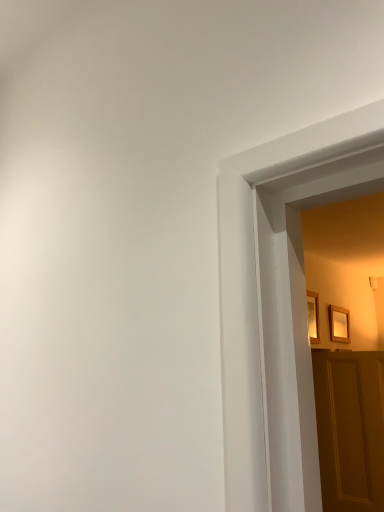
Question: Can you confirm if wooden picture frame at upper right, the first picture frame from the front, is taller than wooden panelled door at right?

Choices:
 (A) no
 (B) yes

Answer: (A)

Question: Is wooden picture frame at upper right, acting as the 1th picture frame starting from the left, surrounding wooden panelled door at right?

Choices:
 (A) no
 (B) yes

Answer: (A)

Question: Is wooden picture frame at upper right, the 2th picture frame in the back-to-front sequence, at the left side of wooden panelled door at right?

Choices:
 (A) yes
 (B) no

Answer: (A)

Question: From the image's perspective, is wooden picture frame at upper right, the 2th picture frame in the back-to-front sequence, located above wooden panelled door at right?

Choices:
 (A) no
 (B) yes

Answer: (B)

Question: Considering the relative sizes of wooden picture frame at upper right, the 2th picture frame in the back-to-front sequence, and wooden panelled door at right in the image provided, is wooden picture frame at upper right, the 2th picture frame in the back-to-front sequence, thinner than wooden panelled door at right?

Choices:
 (A) no
 (B) yes

Answer: (B)

Question: Considering the relative sizes of wooden picture frame at upper right, the 2th picture frame in the back-to-front sequence, and wooden panelled door at right in the image provided, is wooden picture frame at upper right, the 2th picture frame in the back-to-front sequence, bigger than wooden panelled door at right?

Choices:
 (A) yes
 (B) no

Answer: (B)

Question: Is wooden picture frame at upper right, marked as the first picture frame in a back-to-front arrangement, not inside wooden panelled door at right?

Choices:
 (A) no
 (B) yes

Answer: (B)

Question: Is wooden picture frame at upper right, the 1th picture frame in the right-to-left sequence, thinner than wooden panelled door at right?

Choices:
 (A) yes
 (B) no

Answer: (A)

Question: Is wooden picture frame at upper right, the 1th picture frame in the right-to-left sequence, to the right of wooden panelled door at right from the viewer's perspective?

Choices:
 (A) yes
 (B) no

Answer: (A)

Question: Can you confirm if wooden picture frame at upper right, which ranks as the second picture frame in left-to-right order, is shorter than wooden panelled door at right?

Choices:
 (A) yes
 (B) no

Answer: (A)

Question: Is wooden picture frame at upper right, the 2th picture frame in the front-to-back sequence, taller than wooden panelled door at right?

Choices:
 (A) no
 (B) yes

Answer: (A)

Question: Is wooden panelled door at right a part of wooden picture frame at upper right, the 1th picture frame in the right-to-left sequence?

Choices:
 (A) yes
 (B) no

Answer: (B)

Question: From a real-world perspective, is wooden picture frame at upper right, the first picture frame from the front, on top of wooden picture frame at upper right, the 1th picture frame in the right-to-left sequence?

Choices:
 (A) yes
 (B) no

Answer: (A)